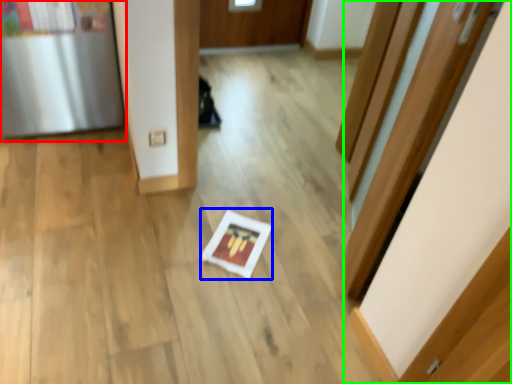
Question: Which is farther away from fridge (highlighted by a red box)? copy (highlighted by a blue box) or door (highlighted by a green box)?

Choices:
 (A) copy
 (B) door

Answer: (B)